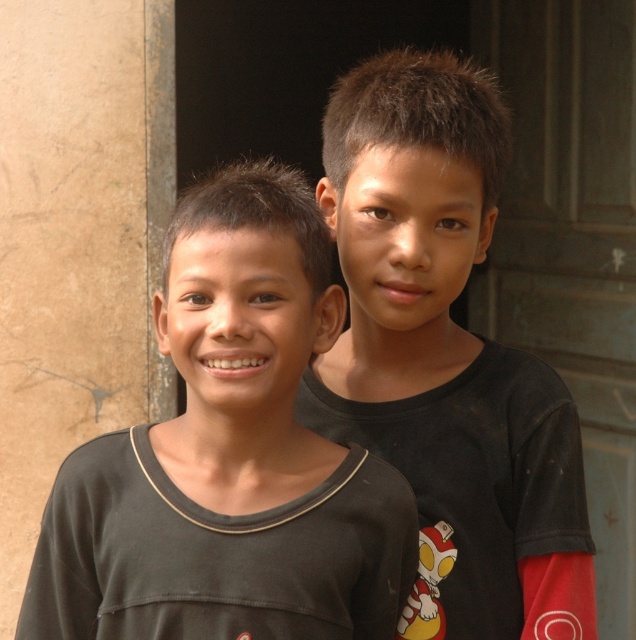
You are a photographer trying to capture a photo of the two boys. You want to ensure that the dark gray shirt at left and the black matte shirt at center are both clearly visible in the frame. Based on their positions, which boy should you focus on first to ensure both are in focus?

The dark gray shirt at left is to the left of the black matte shirt at center. Since they are positioned side by side, focusing on the dark gray shirt at left first will help ensure both are in focus as they are close together.

You are a photographer trying to focus on the point at coordinates point (230, 456). Which boy should you adjust your camera to focus on?

The point (230, 456) is on dark gray shirt at left, so you should adjust your camera to focus on the boy on the left.

You are a photographer trying to determine the best spot to take a photo of both points mentioned. Based on their positions, which point is closer to you, point (350, 627) or point (408, 348)?

Point (350, 627) is closer to the viewer than point (408, 348).